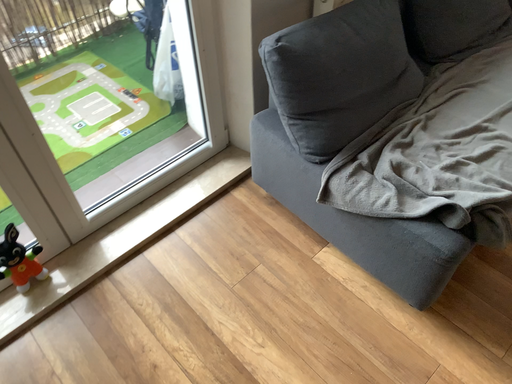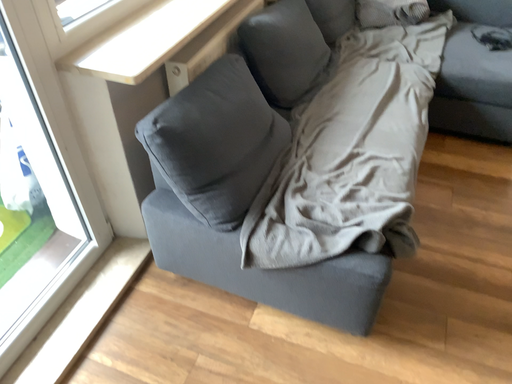
Question: Which way did the camera rotate in the video?

Choices:
 (A) rotated downward
 (B) rotated upward

Answer: (B)